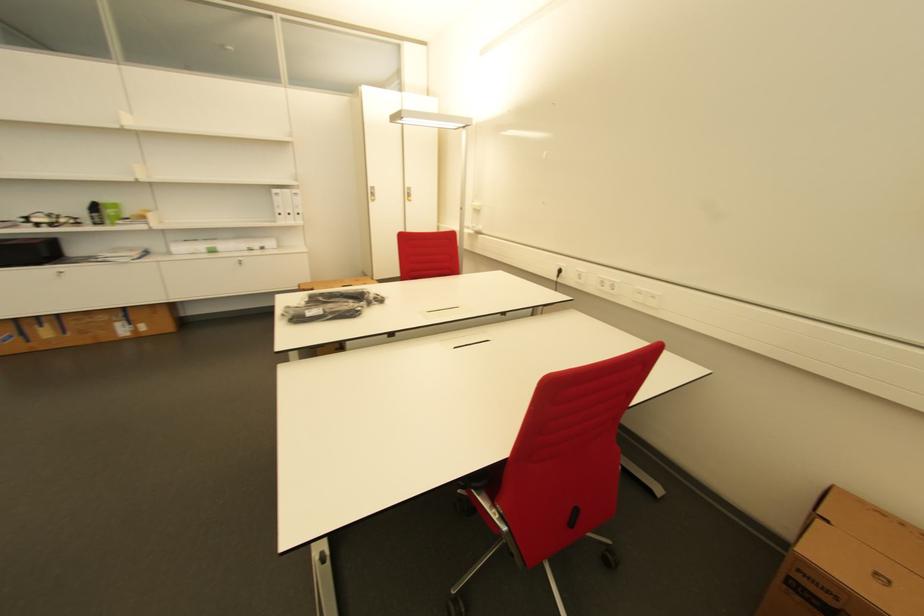
The height and width of the screenshot is (616, 924). Find the location of `black bottle`. black bottle is located at coordinates (94, 213).